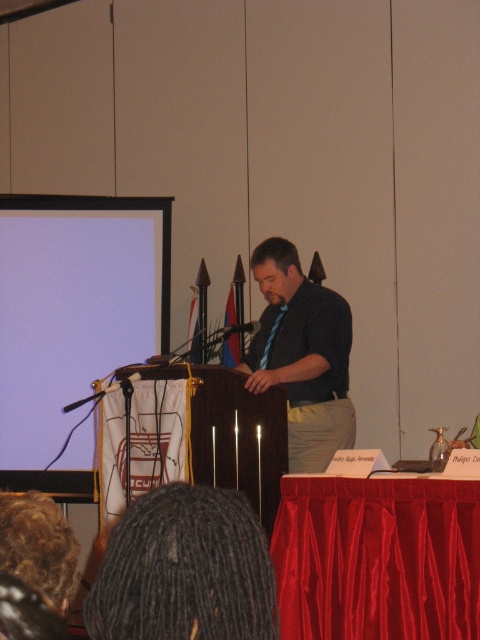
You are a speaker who needs to adjust the focus of your presentation slides displayed on the white matte projection screen at upper left while standing at the dark blue shirt at center. Based on their distance, can you reach the screen to make adjustments without moving from your current position?

The white matte projection screen at upper left and dark blue shirt at center are 3.79 feet apart from each other. Since the distance is relatively short, you might be able to reach the screen from your current position at the dark blue shirt at center, but this depends on your arm length and the accessibility of the screen controls.

You are an event planner setting up a presentation. You need to ensure that the white matte projection screen at upper left is visible to the audience. Considering the distance between the screen and the camera, what is the minimum distance the audience should sit from the screen to have a clear view?

The minimum distance the audience should sit from the white matte projection screen at upper left is approximately 18 feet to ensure clarity, as the screen is 17.96 feet away from the camera which serves as a reference point.

Based on the photo, what are the coordinates of the dark dreadlocks at lower center?

The dark dreadlocks at lower center are located at coordinates point (184, 570).